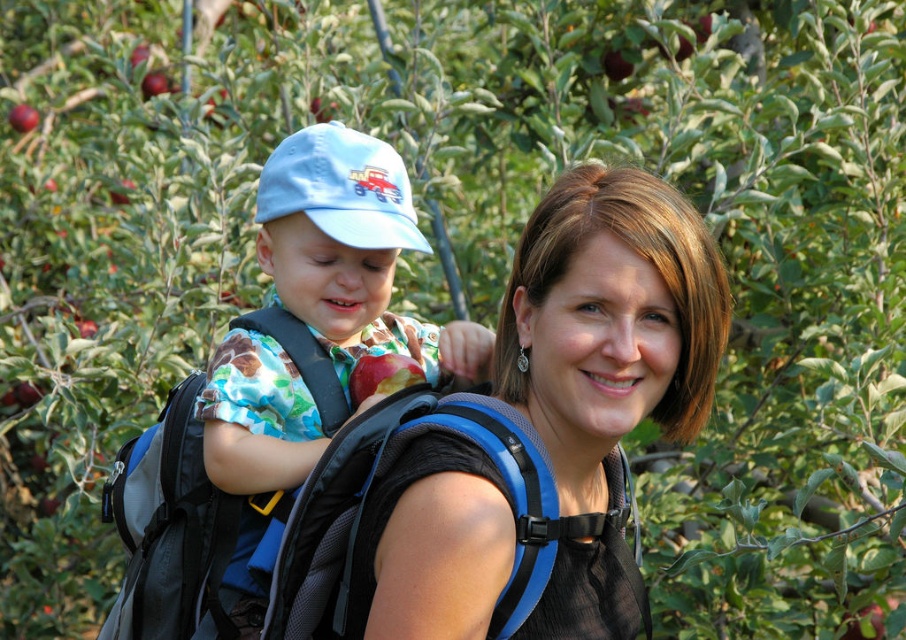
Question: Is matte blue cap at upper left above red matte apple at center?

Choices:
 (A) yes
 (B) no

Answer: (A)

Question: Which point is closer to the camera taking this photo?

Choices:
 (A) (379, 236)
 (B) (352, 378)

Answer: (A)

Question: Which of the following is the closest to the observer?

Choices:
 (A) (389, 376)
 (B) (268, 266)

Answer: (A)

Question: Estimate the real-world distances between objects in this image. Which object is closer to the matte blue cap at upper left?

Choices:
 (A) red matte apple at center
 (B) matte black backpack at center

Answer: (A)

Question: Is matte blue cap at upper left further to the viewer compared to red matte apple at center?

Choices:
 (A) no
 (B) yes

Answer: (A)

Question: Is matte black backpack at center above red matte apple at center?

Choices:
 (A) no
 (B) yes

Answer: (A)